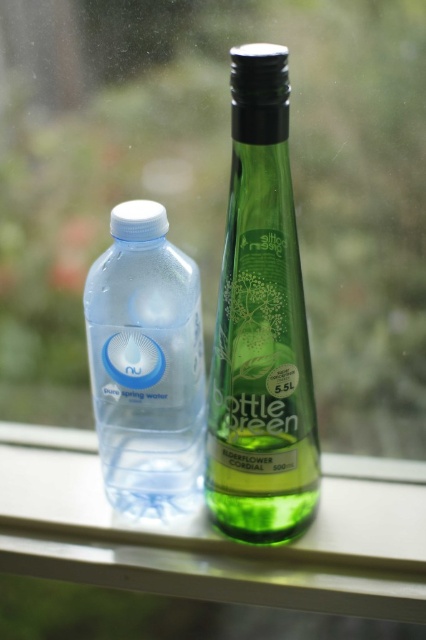
You are trying to place a small plant between the green glass bottle at center and the transparent plastic bottle at left on the windowsill. Based on their positions, can the plant fit between them horizontally?

The green glass bottle at center is located above the transparent plastic bottle at left, so they are not aligned horizontally. Therefore, there is no space between them horizontally for the plant to fit.

You are organizing a picnic and have both the green glass bottle at center and the transparent plastic bottle at left. If you want to carry more liquid, which bottle should you choose?

The green glass bottle at center is larger in size than the transparent plastic bottle at left, so it can hold more liquid. Choose the green glass bottle at center.

You are a photographer standing 1.5 meters away from the windowsill where the two bottles are placed. You want to capture a closeup of the bottles but ensure that the focus remains sharp on both. Given that your camera has a depth of field of 0.5 meters, will both bottles be in focus if you focus on the point at coordinates point [354,512]?

The distance between the point at point [354,512] and the camera is 1.00 meters. Since the photographer is standing 1.5 meters away from the windowsill, the depth of field of 0.5 meters would only cover objects between 1.0 meters and 2.0 meters from the camera. However, the bottles are on the windowsill which is 1.5 meters away, so focusing on the point at point [354,512] would place them within the depth of field range. Therefore, both bottles will be in focus.